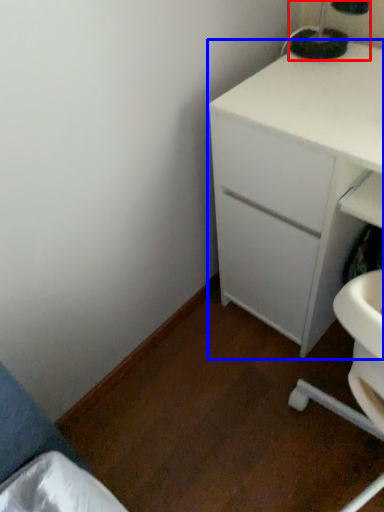
Question: Among these objects, which one is farthest to the camera, bedside lamp (highlighted by a red box) or chest of drawers (highlighted by a blue box)?

Choices:
 (A) bedside lamp
 (B) chest of drawers

Answer: (A)